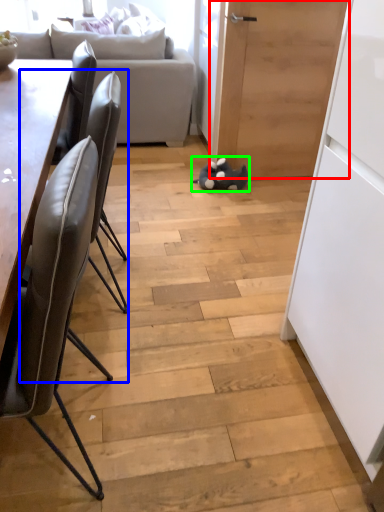
Question: Based on their relative distances, which object is nearer to door (highlighted by a red box)? Choose from chair (highlighted by a blue box) and toy (highlighted by a green box).

Choices:
 (A) chair
 (B) toy

Answer: (B)